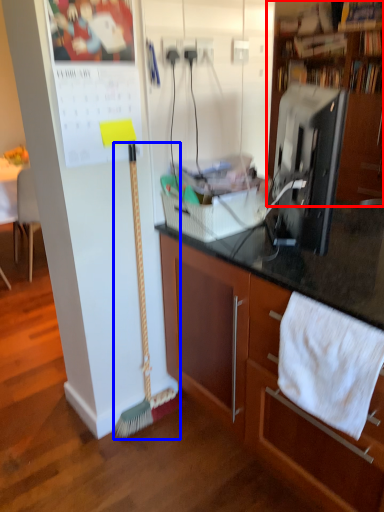
Question: Among these objects, which one is farthest to the camera, cabinetry (highlighted by a red box) or brush (highlighted by a blue box)?

Choices:
 (A) cabinetry
 (B) brush

Answer: (A)